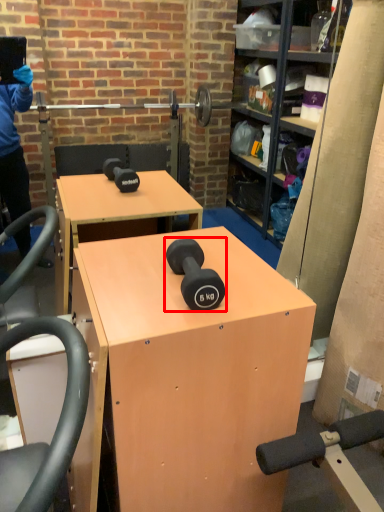
Question: Where is dumbbell (annotated by the red box) located in relation to desk in the image?

Choices:
 (A) right
 (B) left

Answer: (A)